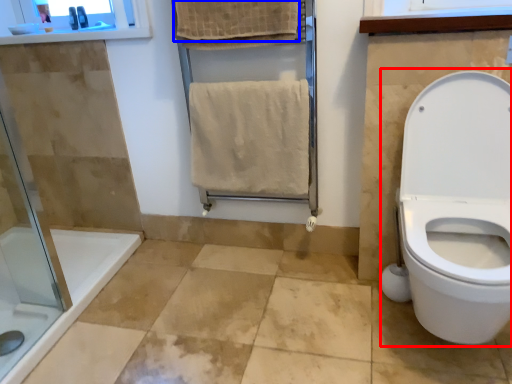
Question: Which object appears closest to the camera in this image, sit (highlighted by a red box) or bath towel (highlighted by a blue box)?

Choices:
 (A) sit
 (B) bath towel

Answer: (A)